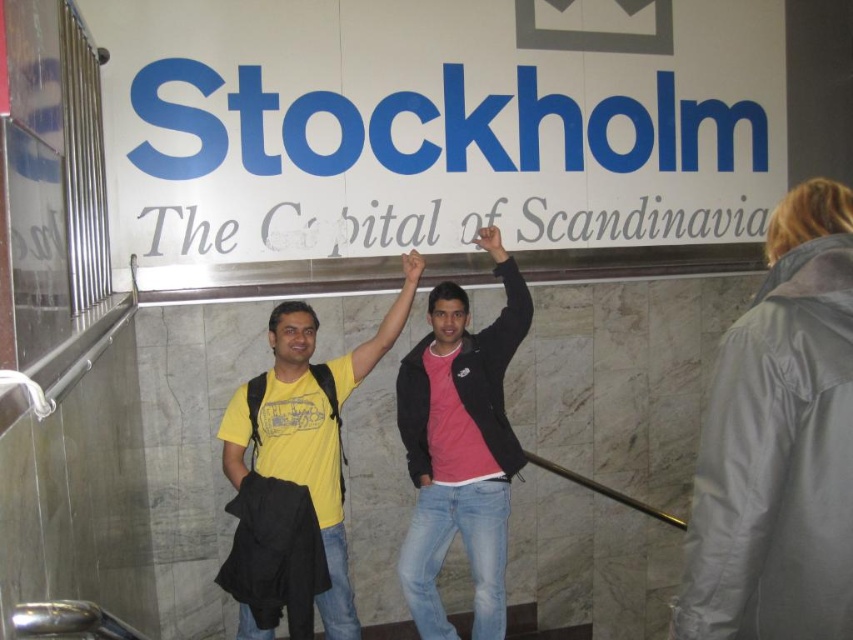
Which is below, pink matte jacket at center or yellow matte t-shirt at center?

pink matte jacket at center is below.

Locate an element on the screen. This screenshot has height=640, width=853. pink matte jacket at center is located at coordinates (460, 448).

Locate an element on the screen. pink matte jacket at center is located at coordinates (460, 448).